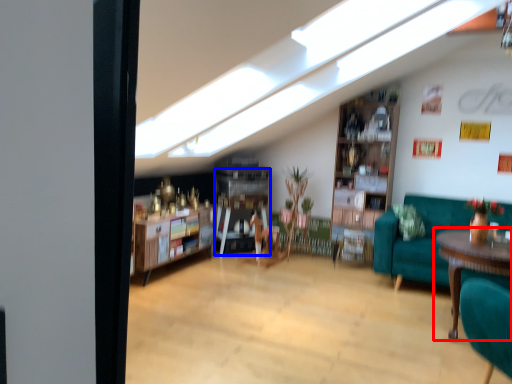
Question: Among these objects, which one is farthest to the camera, table (highlighted by a red box) or shelf (highlighted by a blue box)?

Choices:
 (A) table
 (B) shelf

Answer: (B)